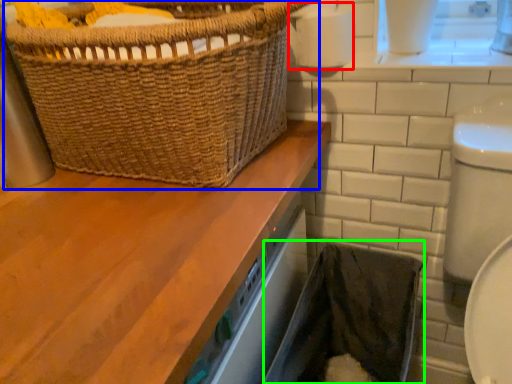
Question: Estimate the real-world distances between objects in this image. Which object is closer to toilet paper (highlighted by a red box), picnic basket (highlighted by a blue box) or laundry basket (highlighted by a green box)?

Choices:
 (A) picnic basket
 (B) laundry basket

Answer: (A)